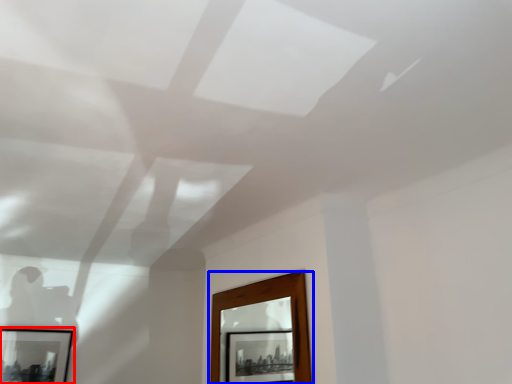
Question: Which object appears farthest to the camera in this image, picture frame (highlighted by a red box) or window (highlighted by a blue box)?

Choices:
 (A) picture frame
 (B) window

Answer: (A)